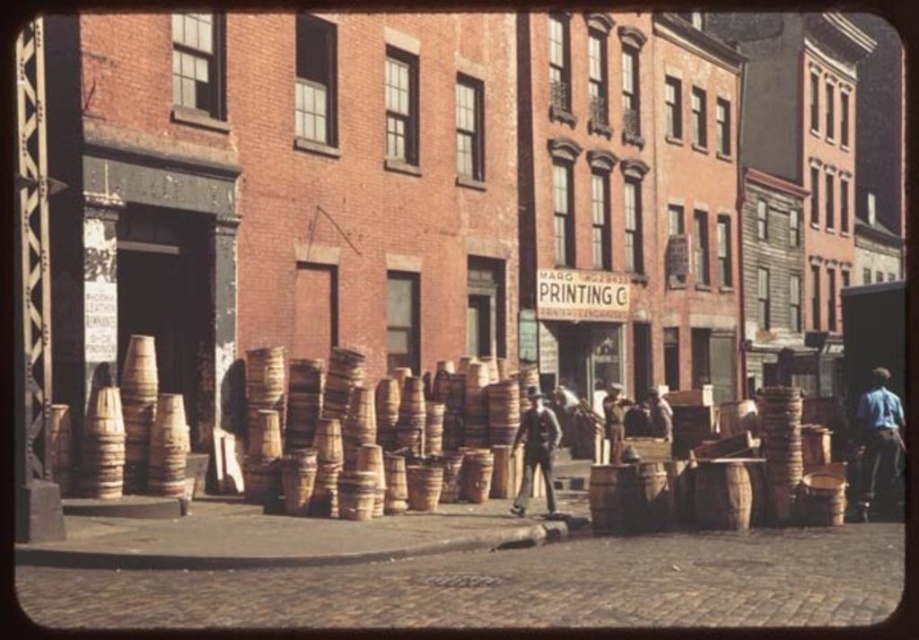
Question: Which object is closer to the camera taking this photo?

Choices:
 (A) blue denim shirt at right
 (B) wooden barrel at center

Answer: (A)

Question: Which object appears farthest from the camera in this image?

Choices:
 (A) blue denim shirt at right
 (B) wooden barrel at center
 (C) dark brown leather coat at center

Answer: (B)

Question: Does wooden barrel at center come in front of blue denim shirt at right?

Choices:
 (A) yes
 (B) no

Answer: (B)

Question: Does wooden barrel at center have a greater width compared to dark brown leather coat at center?

Choices:
 (A) no
 (B) yes

Answer: (B)

Question: Where is wooden barrel at center located in relation to dark brown leather coat at center in the image?

Choices:
 (A) right
 (B) left

Answer: (B)

Question: Which of these objects is positioned farthest from the dark brown leather coat at center?

Choices:
 (A) blue denim shirt at right
 (B) wooden barrel at center

Answer: (A)